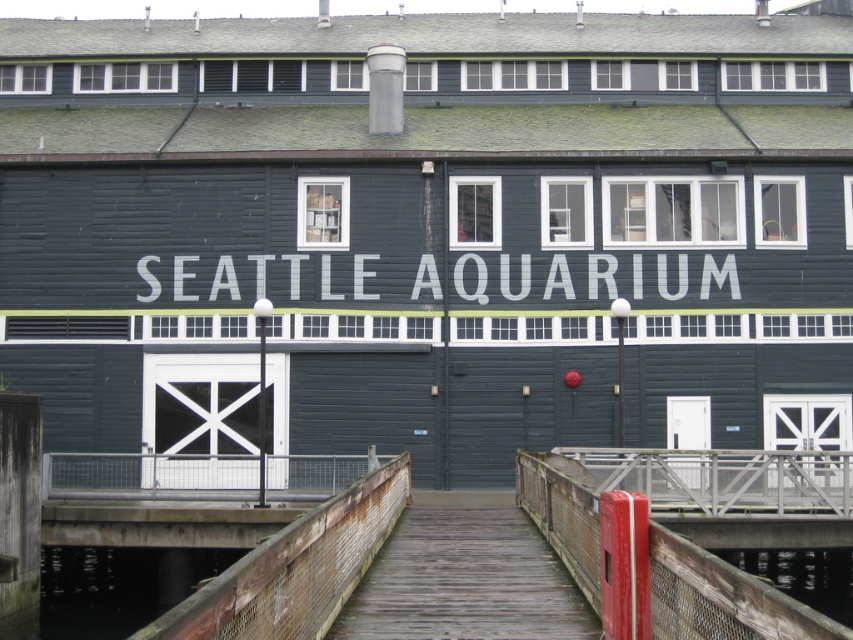
Question: Does white painted wood sign at center have a lesser width compared to transparent glass water at lower right?

Choices:
 (A) no
 (B) yes

Answer: (A)

Question: Which point is farther to the camera?

Choices:
 (A) white painted wood sign at center
 (B) transparent glass water at lower right

Answer: (A)

Question: Is the position of white painted wood sign at center less distant than that of transparent glass water at lower right?

Choices:
 (A) no
 (B) yes

Answer: (A)

Question: Can you confirm if white painted wood sign at center is thinner than transparent glass water at lower right?

Choices:
 (A) no
 (B) yes

Answer: (A)